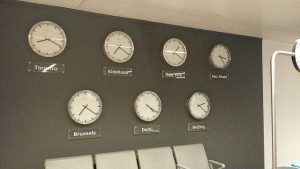
Locate an element on the screen. chair is located at coordinates (188, 151).